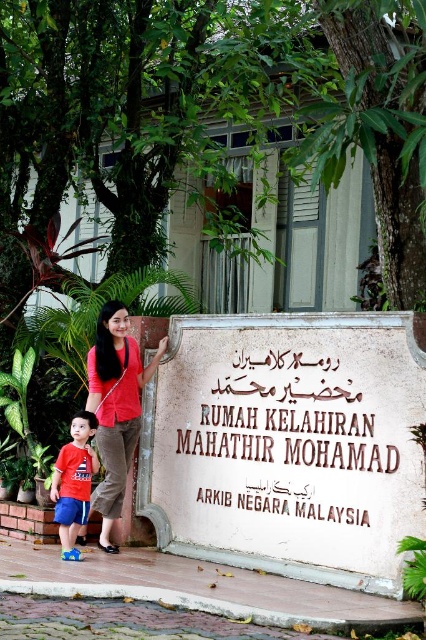
Question: Can you confirm if white stone sign at center is positioned to the right of matte red shirt at center?

Choices:
 (A) yes
 (B) no

Answer: (A)

Question: Which point is closer to the camera taking this photo?

Choices:
 (A) (71, 509)
 (B) (420, 481)

Answer: (B)

Question: Observing the image, what is the correct spatial positioning of white stone sign at center in reference to matte red t-shirt at lower left?

Choices:
 (A) below
 (B) above

Answer: (B)

Question: In this image, where is white stone sign at center located relative to matte red t-shirt at lower left?

Choices:
 (A) left
 (B) right

Answer: (B)

Question: Which point appears farthest from the camera in this image?

Choices:
 (A) (169, 516)
 (B) (72, 468)

Answer: (A)

Question: Estimate the real-world distances between objects in this image. Which object is closer to the matte red t-shirt at lower left?

Choices:
 (A) white stone sign at center
 (B) matte red shirt at center

Answer: (B)